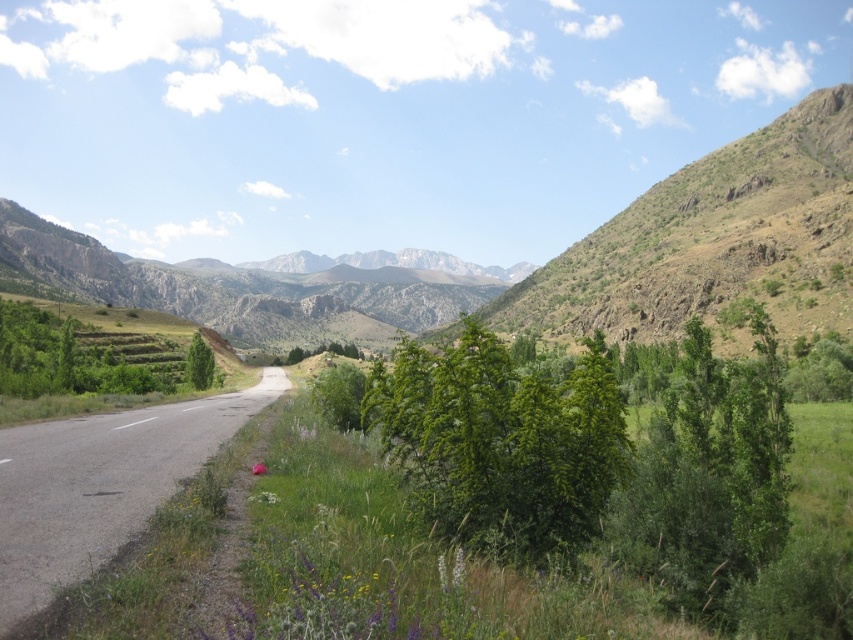
Who is higher up, green asphalt road at center or green grassy mountain at center?

green grassy mountain at center

Can you confirm if green asphalt road at center is positioned to the left of green grassy mountain at center?

No, green asphalt road at center is not to the left of green grassy mountain at center.

Is point (193, 472) closer to viewer compared to point (350, 307)?

That is True.

Identify the location of green asphalt road at center. The width and height of the screenshot is (853, 640). (100, 484).